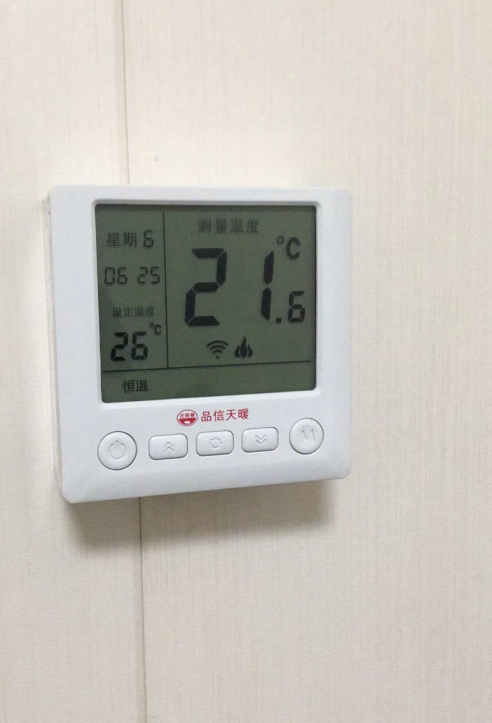
I want to click on digital thermostat, so click(x=72, y=387).